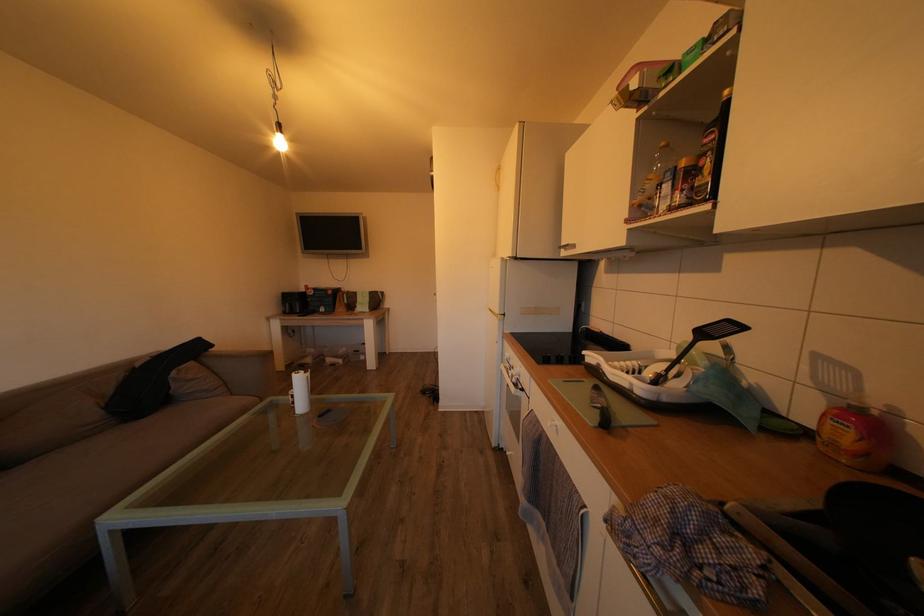
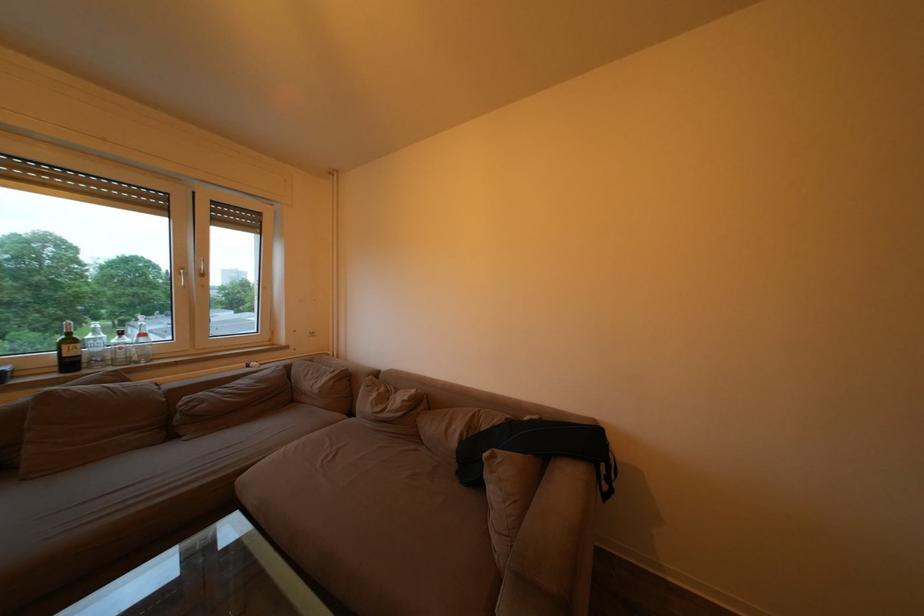
The point at (102, 419) is marked in the first image. Where is the corresponding point in the second image?

(463, 448)